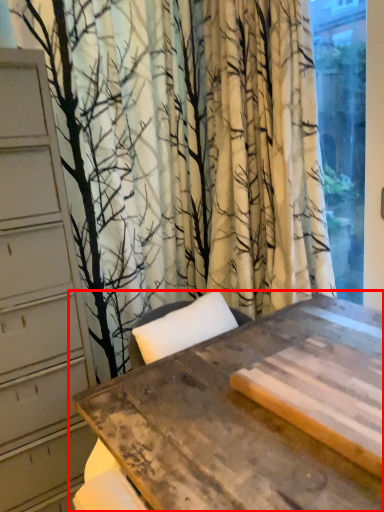
Question: From the image's perspective, what is the correct spatial positioning of table (annotated by the red box) in reference to window?

Choices:
 (A) below
 (B) above

Answer: (A)